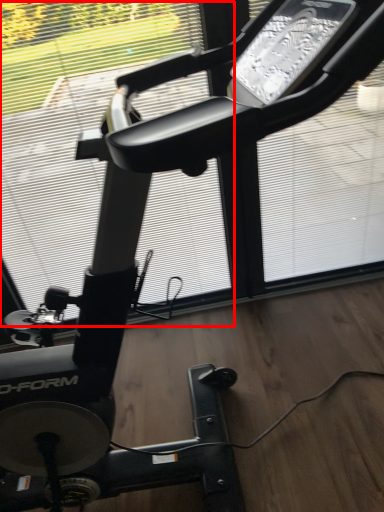
Question: From the image's perspective, where is window screen (annotated by the red box) located relative to window screen?

Choices:
 (A) above
 (B) below

Answer: (B)